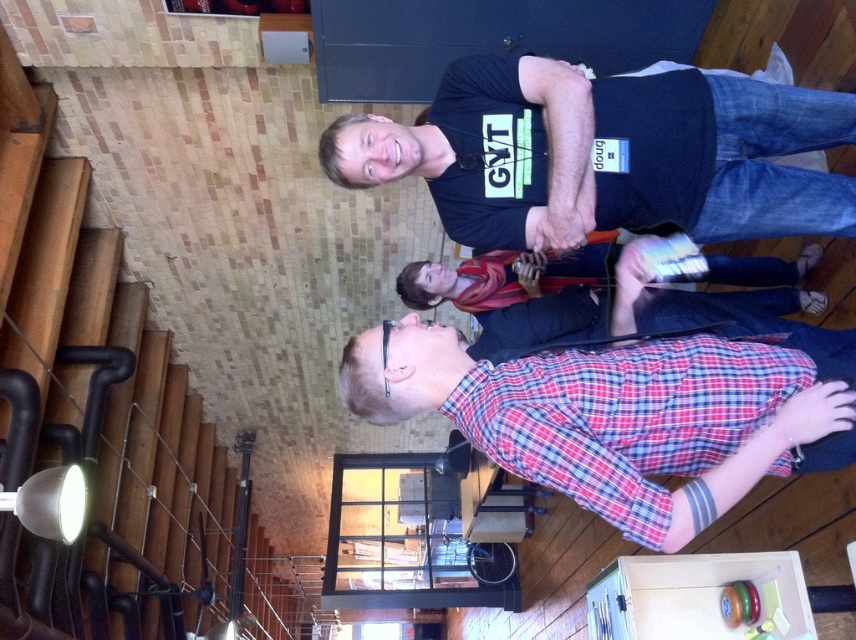
You are standing at the origin point in the image. Which of the two points, point (456, 179) or point (562, 269), is closer to you?

Point (456, 179) is in front of point (562, 269), so it is closer to you.